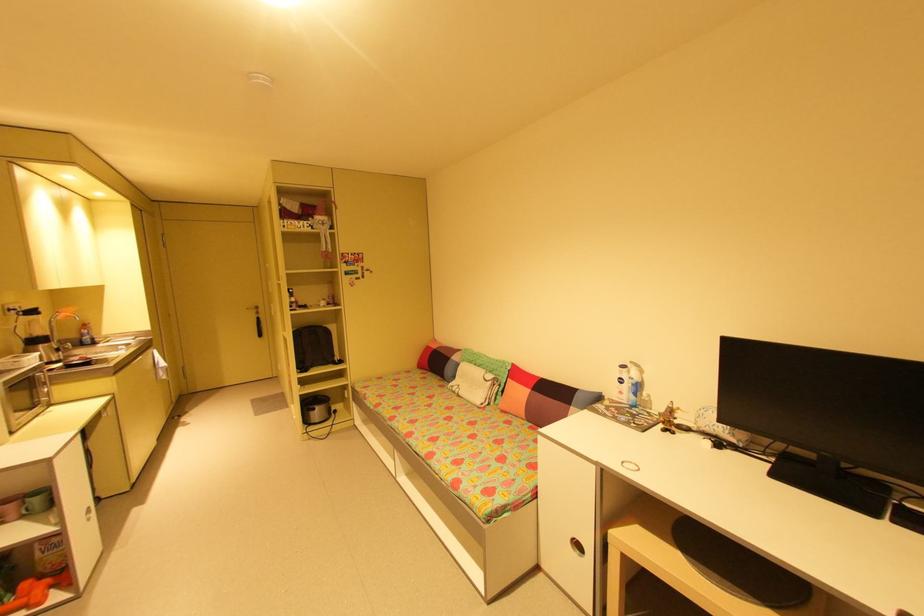
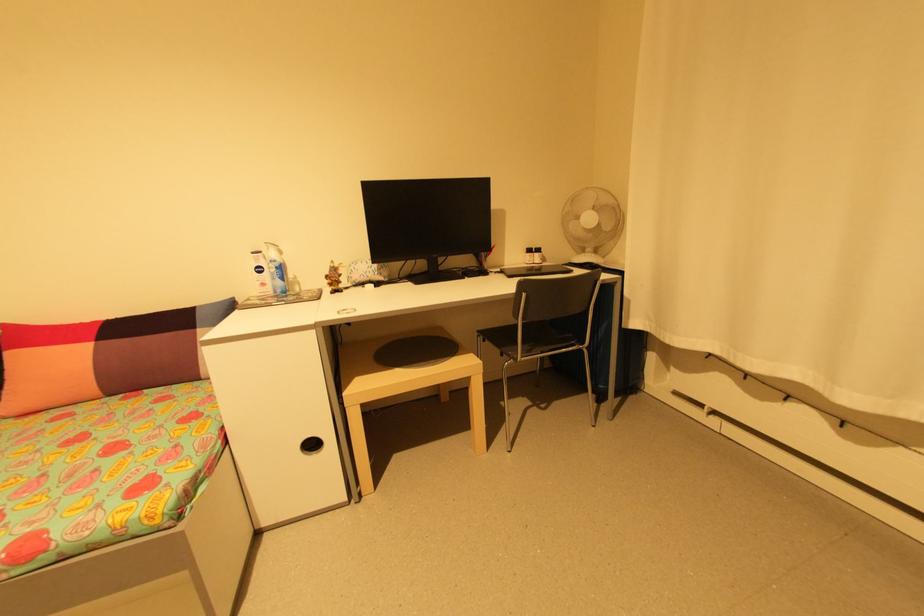
Locate, in the second image, the point that corresponds to (530,422) in the first image.

(111, 399)